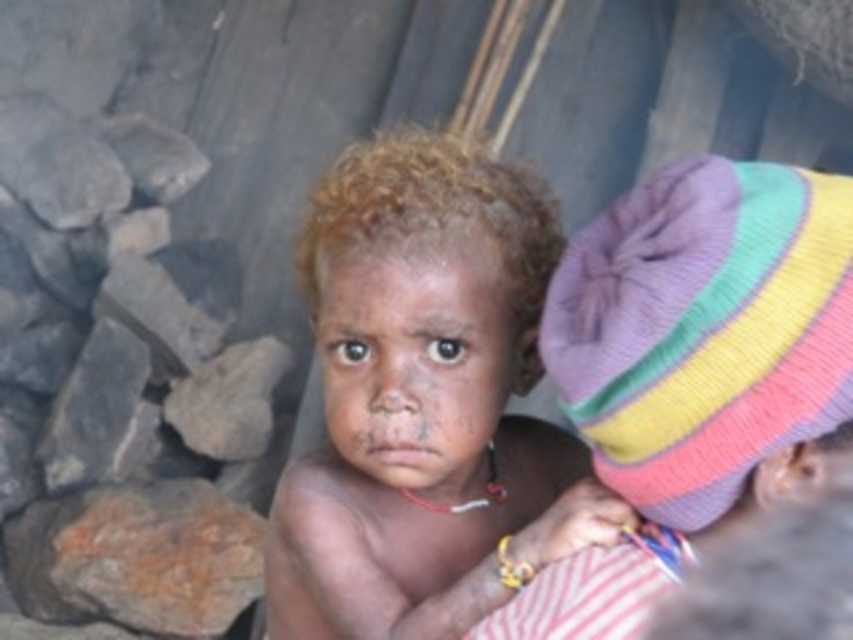
You are a photographer trying to capture a closeup of the dark skin face at center while ensuring the dark skin child at center fits entirely within the frame. Based on the scene description, is it possible to achieve both requirements without cropping either subject?

The dark skin child at center is wider than the dark skin face at center. Since the child is the broader subject, capturing a closeup of the face while keeping the entire child in frame would require adjusting the camera angle or zoom. However, given the width difference, it might be challenging to include both fully without cropping.

Based on the photo, based on the scene description, where is the dark skin child at center located in terms of coordinates?

The dark skin child at center is located at coordinates point (426, 400).